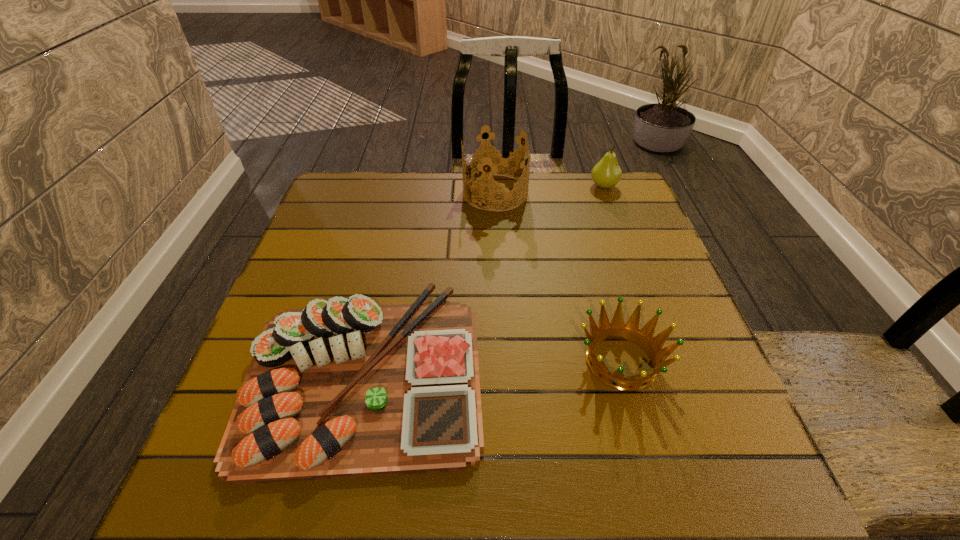
Find the location of a particular element. The width and height of the screenshot is (960, 540). crown that is at the far edge is located at coordinates (496, 159).

Find the location of a particular element. This screenshot has height=540, width=960. pear that is positioned at the far edge is located at coordinates (606, 173).

This screenshot has width=960, height=540. Find the location of `object located at the near edge`. object located at the near edge is located at coordinates (344, 388).

At what (x,y) coordinates should I click in order to perform the action: click on object that is at the left edge. Please return your answer as a coordinate pair (x, y). Image resolution: width=960 pixels, height=540 pixels. Looking at the image, I should click on (344, 388).

You are a GUI agent. You are given a task and a screenshot of the screen. Output one action in this format:
    pyautogui.click(x=<x>, y=<y>)
    Task: Click on the pear at the right edge
    The width and height of the screenshot is (960, 540).
    Given the screenshot: What is the action you would take?
    pyautogui.click(x=606, y=173)

Locate an element on the screen. crown present at the right edge is located at coordinates tap(631, 331).

The height and width of the screenshot is (540, 960). Identify the location of object that is at the near left corner. (344, 388).

Where is `object located in the far right corner section of the desktop`? The image size is (960, 540). object located in the far right corner section of the desktop is located at coordinates (606, 173).

Locate an element on the screen. free space at the far edge is located at coordinates (424, 207).

In the image, there is a desktop. At what (x,y) coordinates should I click in order to perform the action: click on free space at the right edge. Please return your answer as a coordinate pair (x, y). The image size is (960, 540). Looking at the image, I should click on (622, 272).